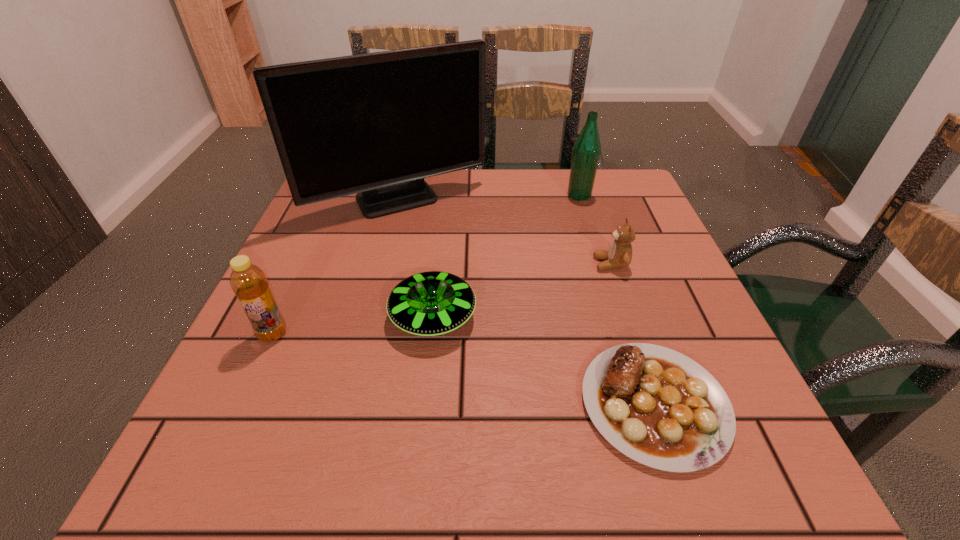
The width and height of the screenshot is (960, 540). I want to click on free space located on the front of the fifth shortest object, so click(x=612, y=300).

Locate an element on the screen. The width and height of the screenshot is (960, 540). vacant space located 0.130m on the front of the nearer bottle is located at coordinates (236, 414).

This screenshot has height=540, width=960. I want to click on vacant space located on the front-facing side of the third shortest object, so click(x=472, y=264).

In order to click on vacant area situated on the front-facing side of the third shortest object in this screenshot , I will do `click(472, 264)`.

The width and height of the screenshot is (960, 540). What are the coordinates of `free space located 0.370m on the front-facing side of the third shortest object` in the screenshot? It's located at point(415,264).

Locate an element on the screen. vacant space located 0.240m on the right of the saucer is located at coordinates (610, 317).

Where is `free spot located on the back of the steak`? This screenshot has width=960, height=540. free spot located on the back of the steak is located at coordinates (607, 260).

The image size is (960, 540). Find the location of `computer monitor that is at the far edge`. computer monitor that is at the far edge is located at coordinates (376, 124).

The width and height of the screenshot is (960, 540). What are the coordinates of `bottle that is at the far edge` in the screenshot? It's located at (586, 152).

You are a GUI agent. You are given a task and a screenshot of the screen. Output one action in this format:
    pyautogui.click(x=<x>, y=<y>)
    Task: Click on the object at the near edge
    The height and width of the screenshot is (540, 960).
    Given the screenshot: What is the action you would take?
    pyautogui.click(x=660, y=408)